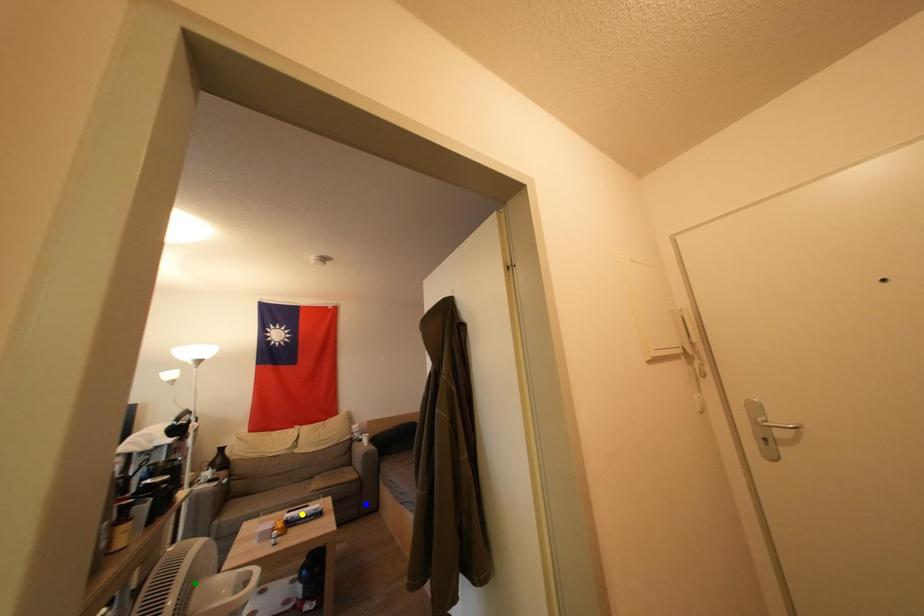
Order these from nearest to farthest:
A) green point
B) yellow point
C) blue point

green point → yellow point → blue point